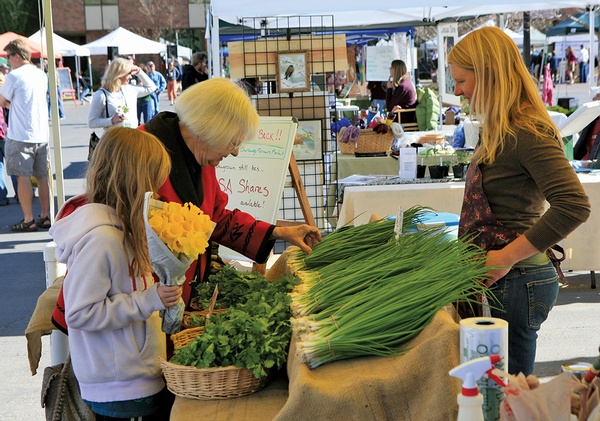
This screenshot has height=421, width=600. I want to click on speakers, so click(x=111, y=51), click(x=173, y=53).